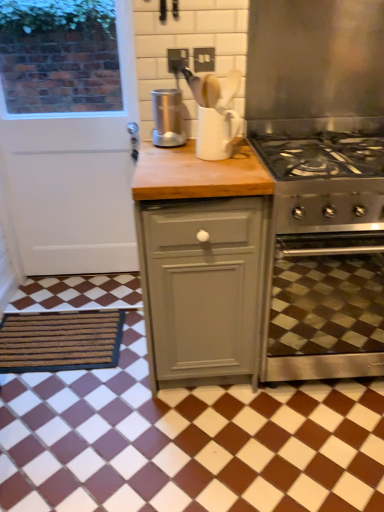
Based on the photo, what is the approximate width of brushed metal canister at upper center?

brushed metal canister at upper center is 5.91 inches in width.

Where is `stainless steel oven at right`? This screenshot has height=512, width=384. stainless steel oven at right is located at coordinates (327, 307).

The width and height of the screenshot is (384, 512). Describe the element at coordinates (60, 341) in the screenshot. I see `brown textured mat at lower left` at that location.

Find the location of a particular element. This screenshot has height=512, width=384. brushed metal canister at upper center is located at coordinates (168, 118).

How many degrees apart are the facing directions of brown textured mat at lower left and stainless steel oven at right?

The facing directions of brown textured mat at lower left and stainless steel oven at right are 0.593 degrees apart.

Is brown textured mat at lower left positioned in front of stainless steel oven at right?

No, brown textured mat at lower left is further to the viewer.

Between brown textured mat at lower left and stainless steel oven at right, which one has more height?

stainless steel oven at right.

Which of these two, stainless steel oven at right or white matte door at left, is wider?

With larger width is stainless steel oven at right.

Is stainless steel oven at right in contact with white matte door at left?

No, stainless steel oven at right is not beside white matte door at left.

From a real-world perspective, between stainless steel oven at right and white matte door at left, who is vertically lower?

In real-world perspective, stainless steel oven at right is lower.

How many degrees apart are the facing directions of stainless steel oven at right and white matte door at left?

The angle between the facing direction of stainless steel oven at right and the facing direction of white matte door at left is 1.1 degrees.

Is brown textured mat at lower left outside of stainless steel exhaust hood at upper right?

Yes, brown textured mat at lower left is outside of stainless steel exhaust hood at upper right.

Is brown textured mat at lower left far away from stainless steel exhaust hood at upper right?

That's right, there is a large distance between brown textured mat at lower left and stainless steel exhaust hood at upper right.

Can you tell me how much brown textured mat at lower left and stainless steel exhaust hood at upper right differ in facing direction?

The angle between the facing direction of brown textured mat at lower left and the facing direction of stainless steel exhaust hood at upper right is 0.69 degrees.

Does brown textured mat at lower left appear on the left side of white matte door at left?

Indeed, brown textured mat at lower left is positioned on the left side of white matte door at left.

Is brown textured mat at lower left beside white matte door at left?

There is a gap between brown textured mat at lower left and white matte door at left.

From the picture: Is brown textured mat at lower left completely or partially outside of white matte door at left?

Indeed, brown textured mat at lower left is completely outside white matte door at left.

In the scene shown: Is matte gray cabinet at center located within stainless steel oven at right?

No, matte gray cabinet at center is not inside stainless steel oven at right.

Which is more to the right, stainless steel oven at right or matte gray cabinet at center?

From the viewer's perspective, stainless steel oven at right appears more on the right side.

Is stainless steel oven at right turned away from matte gray cabinet at center?

No, matte gray cabinet at center is not at the back of stainless steel oven at right.

Can you tell me how much stainless steel oven at right and matte gray cabinet at center differ in facing direction?

The facing directions of stainless steel oven at right and matte gray cabinet at center are 0.337 degrees apart.

Is stainless steel exhaust hood at upper right placed right next to white matte door at left?

No.

Could you tell me if stainless steel exhaust hood at upper right is facing white matte door at left?

No, stainless steel exhaust hood at upper right is not turned towards white matte door at left.

Considering the positions of objects stainless steel exhaust hood at upper right and white matte door at left in the image provided, who is behind, stainless steel exhaust hood at upper right or white matte door at left?

Positioned behind is white matte door at left.

From a real-world perspective, which is physically below, stainless steel exhaust hood at upper right or white matte door at left?

In real-world perspective, white matte door at left is lower.

Is stainless steel exhaust hood at upper right oriented away from brushed metal canister at upper center?

stainless steel exhaust hood at upper right is not turned away from brushed metal canister at upper center.

From the image's perspective, which object appears higher, stainless steel exhaust hood at upper right or brushed metal canister at upper center?

brushed metal canister at upper center.

Locate an element on the screen. Image resolution: width=384 pixels, height=512 pixels. kitchen appliance below the stainless steel exhaust hood at upper right (from a real-world perspective) is located at coordinates (168, 118).

Is stainless steel exhaust hood at upper right situated inside brushed metal canister at upper center or outside?

stainless steel exhaust hood at upper right is spatially situated outside brushed metal canister at upper center.

The height and width of the screenshot is (512, 384). In the image, there is a brown textured mat at lower left. Identify the location of oven above it (from the image's perspective). (327, 307).

I want to click on oven below the white matte door at left (from the image's perspective), so click(327, 307).

Looking at the image, which one is located closer to matte gray cabinet at center, stainless steel exhaust hood at upper right or stainless steel oven at right?

stainless steel oven at right.

Considering their positions, is brushed metal canister at upper center positioned closer to matte gray cabinet at center than stainless steel oven at right?

Based on the image, stainless steel oven at right appears to be nearer to matte gray cabinet at center.

Estimate the real-world distances between objects in this image. Which object is closer to white matte door at left, brushed metal canister at upper center or brown textured mat at lower left?

brown textured mat at lower left lies closer to white matte door at left than the other object.

Which object lies further to the anchor point matte gray cabinet at center, brushed metal canister at upper center or white matte door at left?

white matte door at left.

Which object lies nearer to the anchor point stainless steel exhaust hood at upper right, matte gray cabinet at center or brushed metal canister at upper center?

brushed metal canister at upper center is positioned closer to the anchor stainless steel exhaust hood at upper right.

Considering their positions, is brushed metal canister at upper center positioned further to matte gray cabinet at center than white glossy mug at upper center?

Based on the image, brushed metal canister at upper center appears to be further to matte gray cabinet at center.

Looking at the image, which one is located closer to stainless steel exhaust hood at upper right, stainless steel oven at right or white matte door at left?

The object closer to stainless steel exhaust hood at upper right is stainless steel oven at right.

Consider the image. Considering their positions, is stainless steel oven at right positioned closer to white matte door at left than white glossy mug at upper center?

white glossy mug at upper center is positioned closer to the anchor white matte door at left.

Identify the location of door between brushed metal canister at upper center and brown textured mat at lower left vertically. (72, 181).

Find the location of `cabinetry between brushed metal canister at upper center and stainless steel oven at right from left to right`. cabinetry between brushed metal canister at upper center and stainless steel oven at right from left to right is located at coordinates (201, 262).

Locate an element on the screen. Image resolution: width=384 pixels, height=512 pixels. kitchen appliance between brown textured mat at lower left and stainless steel oven at right in the horizontal direction is located at coordinates (168, 118).

This screenshot has width=384, height=512. Find the location of `appliance that lies between brushed metal canister at upper center and matte gray cabinet at center from top to bottom`. appliance that lies between brushed metal canister at upper center and matte gray cabinet at center from top to bottom is located at coordinates (216, 133).